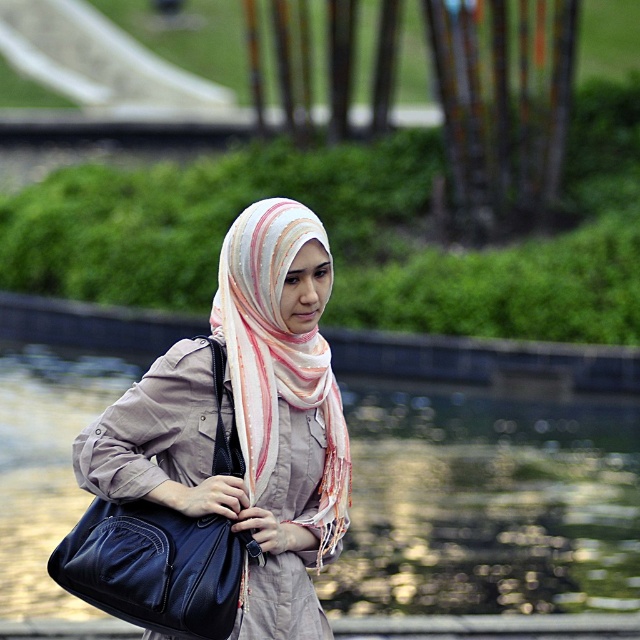
You are standing in a park and see a person walking near a pond. You want to take a photo of them from a specific point that is 50 feet away. Is the point at coordinates point [24,563] within the desired distance?

The distance of point [24,563] from viewer is 57.25 feet, which is further than 50 feet. Therefore, the point is outside the desired distance for the photo.

You are a photographer trying to capture the person in the scene. If you want to focus on the matte beige scarf at center without the matte blue leather bag at center blocking it, should you move the camera to the left or right?

The matte blue leather bag at center is behind the matte beige scarf at center, so moving the camera to the left or right won not change the position of the bag relative to the scarf. To avoid the bag blocking the scarf, you might need to adjust the angle or zoom in closer.